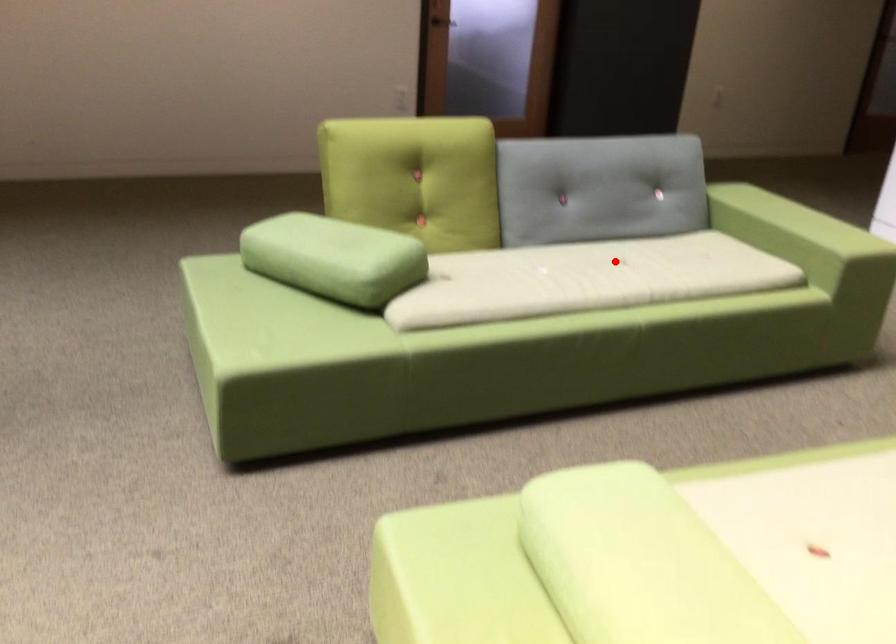
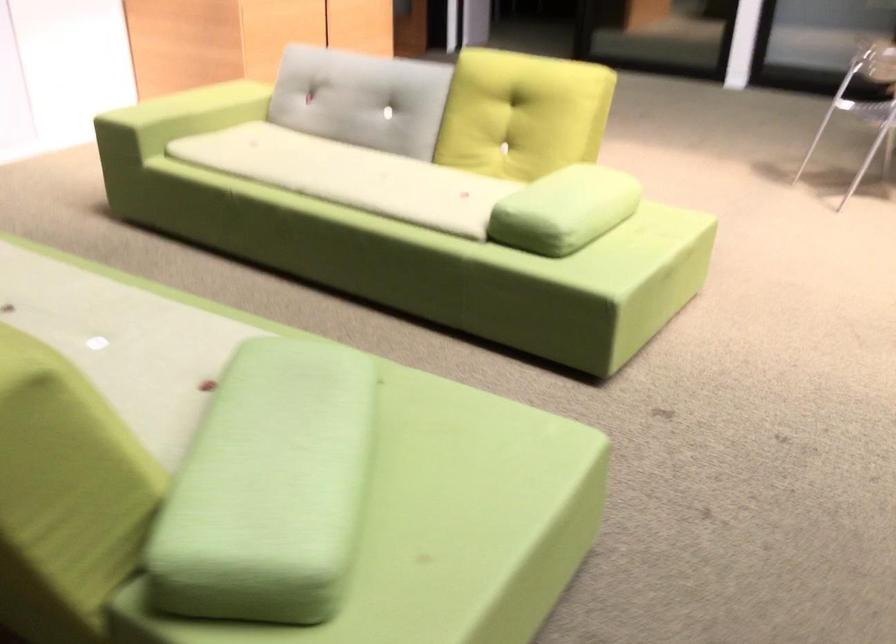
Locate, in the second image, the point that corresponds to the highlighted location in the first image.

(66, 290)